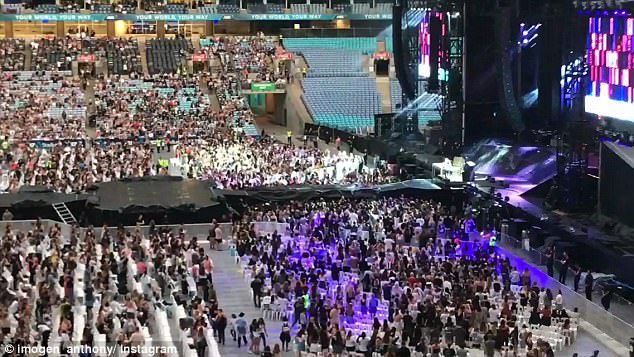
Identify the location of hallway. (266, 110).